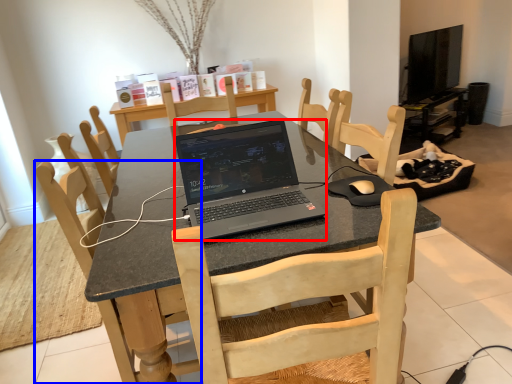
Question: Among these objects, which one is farthest to the camera, laptop (highlighted by a red box) or chair (highlighted by a blue box)?

Choices:
 (A) laptop
 (B) chair

Answer: (B)